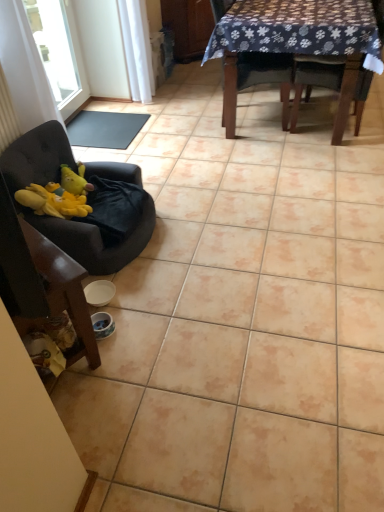
This screenshot has height=512, width=384. Describe the element at coordinates (72, 181) in the screenshot. I see `yellow plush at left` at that location.

At what (x,y) coordinates should I click in order to perform the action: click on yellow plush at left. Please return your answer as a coordinate pair (x, y). The width and height of the screenshot is (384, 512). Looking at the image, I should click on (72, 181).

The image size is (384, 512). What do you see at coordinates (95, 240) in the screenshot?
I see `velvet dark gray chair at left, which is the 2th chair from left to right` at bounding box center [95, 240].

Where is `transparent glass window at upper left`? transparent glass window at upper left is located at coordinates (55, 47).

Describe the element at coordinates (293, 47) in the screenshot. I see `wooden table at upper center` at that location.

Where is `yellow plush at left`? yellow plush at left is located at coordinates (72, 181).

From a real-world perspective, is yellow plush at left below velvet dark brown armchair at left, placed as the first chair when sorted from left to right?

No, from a real-world perspective, yellow plush at left is not below velvet dark brown armchair at left, placed as the first chair when sorted from left to right.

Is point (76, 187) farther from camera compared to point (20, 267)?

Yes, it is.

Is yellow plush at left taller than velvet dark brown armchair at left, acting as the 4th chair starting from the right?

In fact, yellow plush at left may be shorter than velvet dark brown armchair at left, acting as the 4th chair starting from the right.

Can you confirm if yellow plush at left is smaller than velvet dark brown armchair at left, placed as the first chair when sorted from left to right?

Yes, yellow plush at left is smaller than velvet dark brown armchair at left, placed as the first chair when sorted from left to right.

From the image's perspective, which one is positioned lower, wooden table at upper center or yellow plush at left?

yellow plush at left is shown below in the image.

Is wooden table at upper center spatially inside yellow plush at left, or outside of it?

wooden table at upper center is not enclosed by yellow plush at left.

The width and height of the screenshot is (384, 512). In order to click on table above the yellow plush at left (from a real-world perspective) in this screenshot , I will do `click(293, 47)`.

Is wooden table at upper center far away from yellow plush at left?

Yes.

From a real-world perspective, is black rubber mat at center over velvet dark brown armchair at left, placed as the first chair when sorted from left to right?

No.

Considering the sizes of black rubber mat at center and velvet dark brown armchair at left, acting as the 4th chair starting from the right, in the image, is black rubber mat at center bigger or smaller than velvet dark brown armchair at left, acting as the 4th chair starting from the right,?

In the image, black rubber mat at center appears to be smaller than velvet dark brown armchair at left, acting as the 4th chair starting from the right.

Is black rubber mat at center positioned with its back to velvet dark brown armchair at left, placed as the first chair when sorted from left to right?

No.

Does black rubber mat at center lie in front of velvet dark brown armchair at left, acting as the 4th chair starting from the right?

No, the depth of black rubber mat at center is greater than that of velvet dark brown armchair at left, acting as the 4th chair starting from the right.

Is dark fabric chair at upper right, arranged as the fourth chair when viewed from the left, inside the boundaries of velvet dark gray chair at left, arranged as the third chair when viewed from the right, or outside?

dark fabric chair at upper right, arranged as the fourth chair when viewed from the left, is not enclosed by velvet dark gray chair at left, arranged as the third chair when viewed from the right.

Can you confirm if dark fabric chair at upper right, the 1th chair in the right-to-left sequence, is positioned to the right of velvet dark gray chair at left, which is the 2th chair from left to right?

Yes.

Which of these two, dark fabric chair at upper right, the 1th chair in the right-to-left sequence, or velvet dark gray chair at left, arranged as the third chair when viewed from the right, is thinner?

Thinner between the two is velvet dark gray chair at left, arranged as the third chair when viewed from the right.

Can you tell me how much dark fabric chair at upper right, arranged as the fourth chair when viewed from the left, and velvet dark gray chair at left, which is the 2th chair from left to right, differ in facing direction?

175 degrees.

Locate an element on the screen. This screenshot has width=384, height=512. mat below the transparent glass window at upper left (from the image's perspective) is located at coordinates (105, 129).

Looking at this image, from the image's perspective, which object appears higher, transparent glass window at upper left or black rubber mat at center?

From the image's view, transparent glass window at upper left is above.

Is black rubber mat at center completely or partially inside transparent glass window at upper left?

No, black rubber mat at center is not a part of transparent glass window at upper left.

From the image's perspective, is velvet dark brown armchair at left, placed as the first chair when sorted from left to right, located above or below black rubber mat at center?

velvet dark brown armchair at left, placed as the first chair when sorted from left to right, is situated lower than black rubber mat at center in the image.

Visually, is velvet dark brown armchair at left, acting as the 4th chair starting from the right, positioned to the left or to the right of black rubber mat at center?

Based on their positions, velvet dark brown armchair at left, acting as the 4th chair starting from the right, is located to the right of black rubber mat at center.

In order to click on mat that appears behind the velvet dark brown armchair at left, placed as the first chair when sorted from left to right in this screenshot , I will do `click(105, 129)`.

Considering the sizes of velvet dark brown armchair at left, acting as the 4th chair starting from the right, and black rubber mat at center in the image, is velvet dark brown armchair at left, acting as the 4th chair starting from the right, wider or thinner than black rubber mat at center?

In the image, velvet dark brown armchair at left, acting as the 4th chair starting from the right, appears to be more narrow than black rubber mat at center.

Does point (38, 254) appear closer or farther from the camera than point (301, 91)?

Clearly, point (38, 254) is closer to the camera than point (301, 91).

Between velvet dark brown armchair at left, placed as the first chair when sorted from left to right, and dark fabric chair at upper right, the 1th chair in the right-to-left sequence, which one is positioned in front?

velvet dark brown armchair at left, placed as the first chair when sorted from left to right, is in front.

Do you think velvet dark brown armchair at left, acting as the 4th chair starting from the right, is within dark fabric chair at upper right, the 1th chair in the right-to-left sequence, or outside of it?

velvet dark brown armchair at left, acting as the 4th chair starting from the right, is not inside dark fabric chair at upper right, the 1th chair in the right-to-left sequence, it's outside.

This screenshot has width=384, height=512. I want to click on toy lying behind the velvet dark brown armchair at left, acting as the 4th chair starting from the right, so click(x=72, y=181).

In order to click on toy below the wooden table at upper center (from the image's perspective) in this screenshot , I will do tap(72, 181).

Based on their spatial positions, is dark fabric chair at upper right, arranged as the fourth chair when viewed from the left, or black rubber mat at center closer to wooden chair at upper right, which is counted as the 3th chair, starting from the left?

dark fabric chair at upper right, arranged as the fourth chair when viewed from the left, is closer to wooden chair at upper right, which is counted as the 3th chair, starting from the left.

From the picture: When comparing their distances from dark fabric chair at upper right, arranged as the fourth chair when viewed from the left, does velvet dark brown armchair at left, acting as the 4th chair starting from the right, or black rubber mat at center seem further?

Among the two, velvet dark brown armchair at left, acting as the 4th chair starting from the right, is located further to dark fabric chair at upper right, arranged as the fourth chair when viewed from the left.

Looking at the image, which one is located closer to velvet dark brown armchair at left, placed as the first chair when sorted from left to right, transparent glass window at upper left or wooden table at upper center?

wooden table at upper center is positioned closer to the anchor velvet dark brown armchair at left, placed as the first chair when sorted from left to right.

Based on their spatial positions, is transparent glass window at upper left or yellow plush at left closer to wooden chair at upper right, the second chair from the right?

yellow plush at left is positioned closer to the anchor wooden chair at upper right, the second chair from the right.

Looking at this image, based on their spatial positions, is black rubber mat at center or transparent glass window at upper left further from wooden chair at upper right, the second chair from the right?

The object further to wooden chair at upper right, the second chair from the right, is transparent glass window at upper left.

Consider the image. When comparing their distances from transparent glass window at upper left, does black rubber mat at center or yellow plush at left seem further?

Based on the image, yellow plush at left appears to be further to transparent glass window at upper left.

When comparing their distances from wooden chair at upper right, which is counted as the 3th chair, starting from the left, does velvet dark gray chair at left, which is the 2th chair from left to right, or black rubber mat at center seem further?

Among the two, velvet dark gray chair at left, which is the 2th chair from left to right, is located further to wooden chair at upper right, which is counted as the 3th chair, starting from the left.

Looking at the image, which one is located closer to wooden table at upper center, dark fabric chair at upper right, the 1th chair in the right-to-left sequence, or black rubber mat at center?

dark fabric chair at upper right, the 1th chair in the right-to-left sequence.

Where is `window between velvet dark brown armchair at left, acting as the 4th chair starting from the right, and black rubber mat at center in the front-back direction`? The width and height of the screenshot is (384, 512). window between velvet dark brown armchair at left, acting as the 4th chair starting from the right, and black rubber mat at center in the front-back direction is located at coordinates (55, 47).

You are a GUI agent. You are given a task and a screenshot of the screen. Output one action in this format:
    pyautogui.click(x=<x>, y=<y>)
    Task: Click on the table located between wooden chair at upper right, the second chair from the right, and dark fabric chair at upper right, arranged as the fourth chair when viewed from the left, in the left-right direction
    This screenshot has height=512, width=384.
    Given the screenshot: What is the action you would take?
    pyautogui.click(x=293, y=47)

Identify the location of toy between velvet dark gray chair at left, which is the 2th chair from left to right, and black rubber mat at center from front to back. This screenshot has width=384, height=512. (72, 181).

Where is `table between yellow plush at left and dark fabric chair at upper right, arranged as the fourth chair when viewed from the left, from left to right`? The height and width of the screenshot is (512, 384). table between yellow plush at left and dark fabric chair at upper right, arranged as the fourth chair when viewed from the left, from left to right is located at coordinates (293, 47).